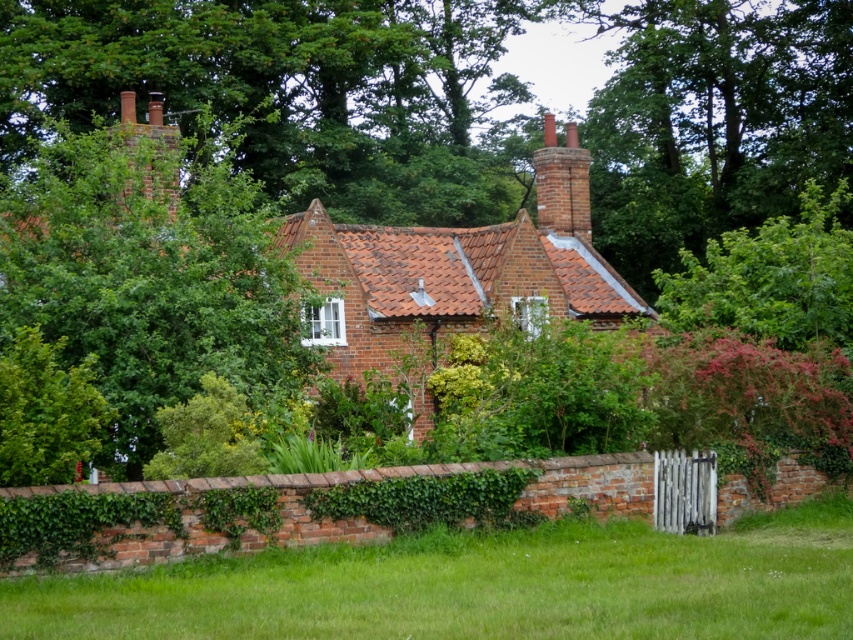
You are a gardener planning to trim the green leafy tree at upper left and the green leafy hedge at lower left. Which of these two plants requires a ladder for pruning?

The green leafy tree at upper left requires a ladder for pruning because it has a larger size compared to the green leafy hedge at lower left.

You are standing in front of the cottage and notice a point marked at coordinates (x=149, y=276). Based on the scene description, what object is located at that point?

The point at coordinates (x=149, y=276) marks the location of the green leafy tree at upper left.

You are a landscape architect planning to add a new garden feature between the brick cottage at center and the green leafy hedge at left. Considering their sizes, which object should you place the feature closer to for better visual balance?

The brick cottage at center is bigger than the green leafy hedge at left, so placing the garden feature closer to the smaller green leafy hedge at left would help achieve better visual balance.